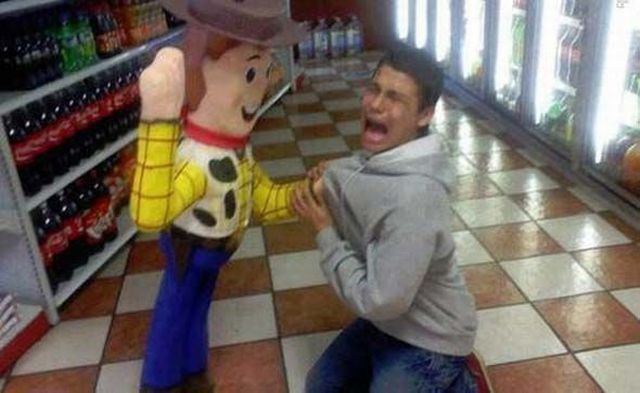
Find the location of a particular element. Image resolution: width=640 pixels, height=393 pixels. shelf is located at coordinates (89, 286), (68, 173), (70, 81).